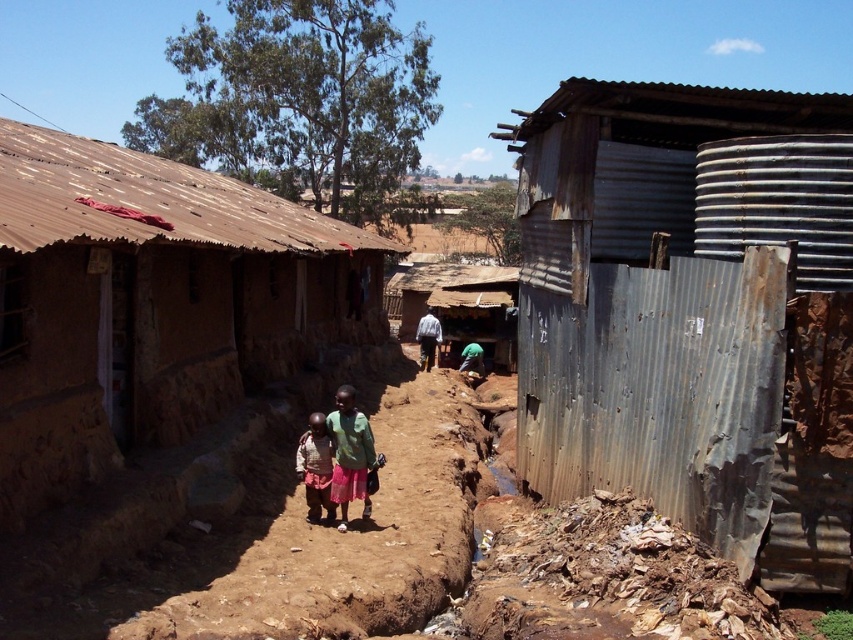
Question: Based on their relative distances, which object is nearer to the brown mud hut at center?

Choices:
 (A) light brown fabric skirt at center
 (B) rusty corrugated metal hut at right
 (C) brown dirt track at center
 (D) green fabric shirt at center

Answer: (C)

Question: Which point is farther to the camera?

Choices:
 (A) brown dirt track at center
 (B) light brown fabric skirt at center
 (C) green fabric shirt at center

Answer: (B)

Question: Can you confirm if brown dirt track at center is positioned below green fabric shirt at center?

Choices:
 (A) no
 (B) yes

Answer: (A)

Question: Does rusty corrugated metal hut at right have a smaller size compared to brown dirt track at center?

Choices:
 (A) yes
 (B) no

Answer: (B)

Question: Does green fabric shirt at center lie behind light brown fabric skirt at center?

Choices:
 (A) no
 (B) yes

Answer: (A)

Question: Which of the following is the farthest from the observer?

Choices:
 (A) (74, 291)
 (B) (445, 307)
 (C) (558, 278)

Answer: (B)